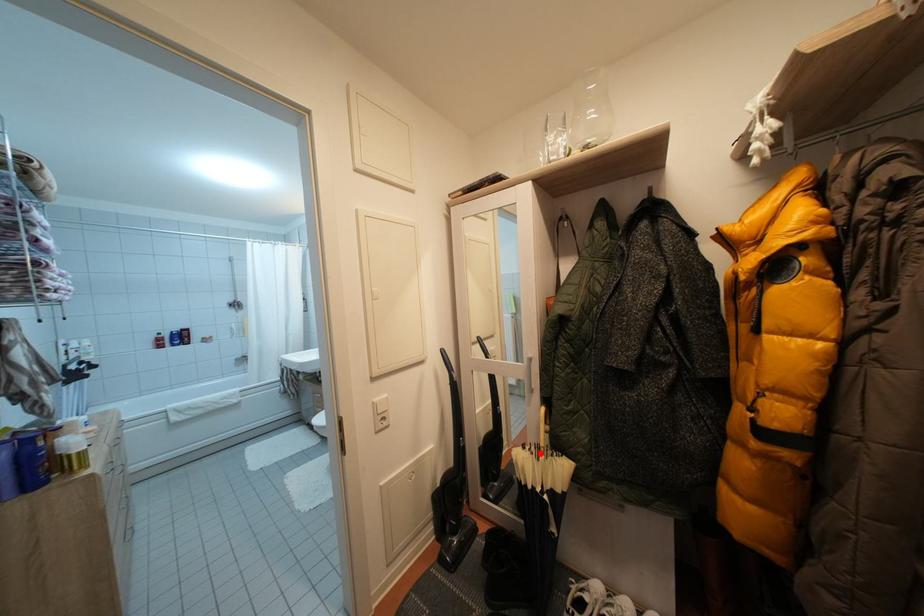
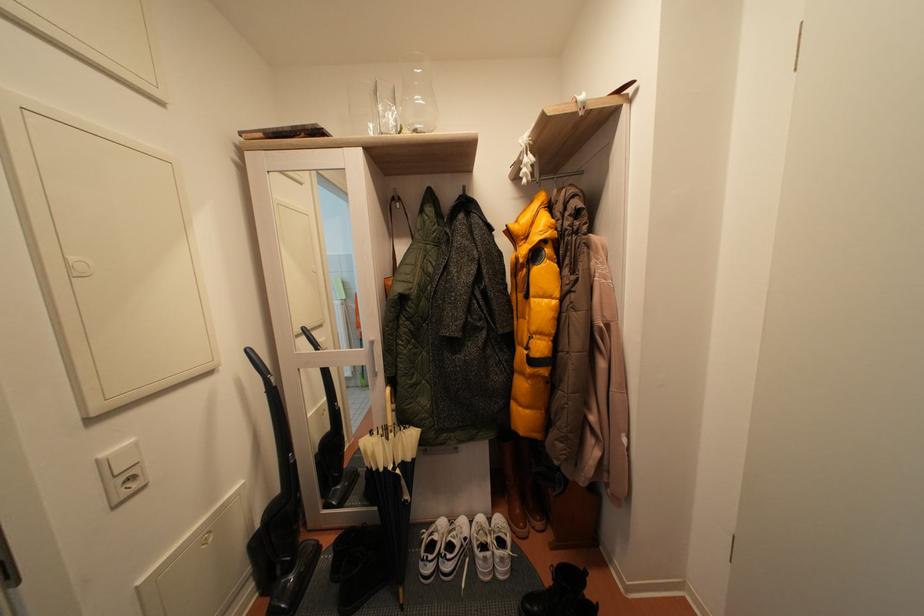
Question: A red point is marked in image1. In image2, is the corresponding 3D point closer to the camera or farther? Reply with the corresponding letter.

Choices:
 (A) The corresponding 3D point is closer.
 (B) The corresponding 3D point is farther.

Answer: (B)